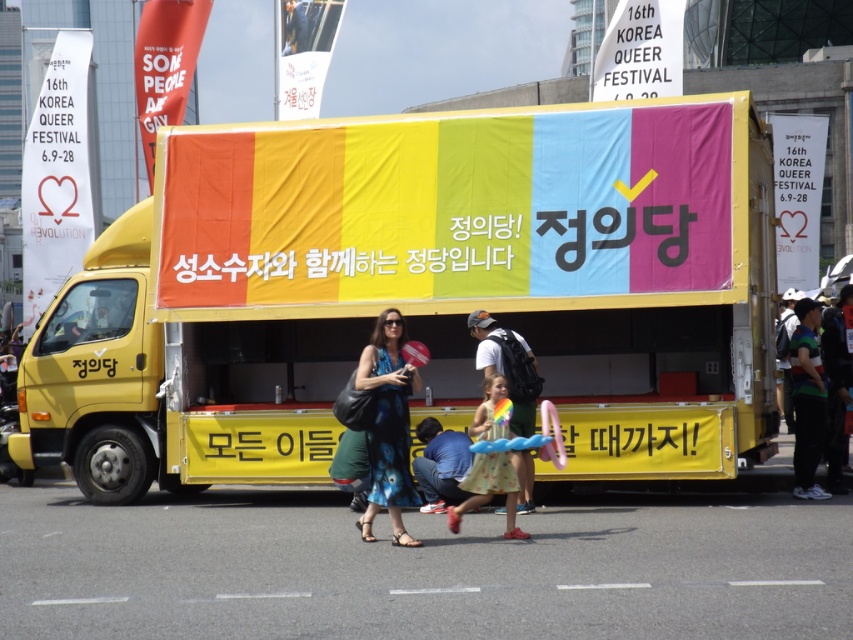
Question: Is white cotton backpack at center further to the viewer compared to blue denim jeans at lower center?

Choices:
 (A) no
 (B) yes

Answer: (A)

Question: Considering the real-world distances, which object is farthest from the yellow matte truck at center?

Choices:
 (A) blue denim jeans at lower center
 (B) blue tie-dye dress at center
 (C) striped fabric shirt at right
 (D) white cotton backpack at center

Answer: (C)

Question: Which object is the farthest from the white cotton backpack at center?

Choices:
 (A) striped fabric shirt at right
 (B) blue tie-dye dress at center
 (C) blue denim jeans at lower center

Answer: (A)

Question: Does blue tie-dye dress at center appear on the right side of striped fabric shirt at right?

Choices:
 (A) no
 (B) yes

Answer: (A)

Question: Is yellow matte truck at center positioned before white cotton backpack at center?

Choices:
 (A) yes
 (B) no

Answer: (B)

Question: Which point is closer to the camera taking this photo?

Choices:
 (A) (810, 333)
 (B) (502, 332)

Answer: (B)